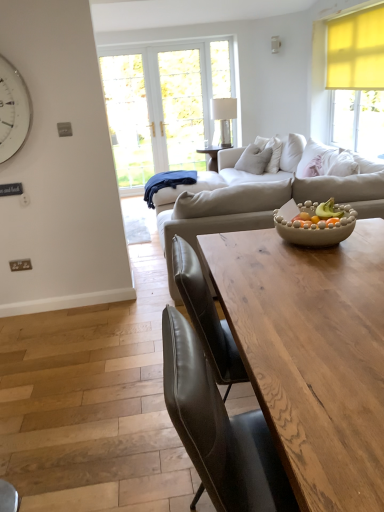
Question: Does wooden table at center have a lesser width compared to beige textured bowl at center?

Choices:
 (A) yes
 (B) no

Answer: (B)

Question: From a real-world perspective, is wooden table at center positioned under beige textured bowl at center based on gravity?

Choices:
 (A) yes
 (B) no

Answer: (A)

Question: Can you confirm if wooden table at center is positioned to the right of beige textured bowl at center?

Choices:
 (A) yes
 (B) no

Answer: (B)

Question: Can you confirm if wooden table at center is smaller than beige textured bowl at center?

Choices:
 (A) no
 (B) yes

Answer: (A)

Question: Does wooden table at center have a greater width compared to beige textured bowl at center?

Choices:
 (A) no
 (B) yes

Answer: (B)

Question: Considering the relative sizes of wooden table at center and beige textured bowl at center in the image provided, is wooden table at center taller than beige textured bowl at center?

Choices:
 (A) no
 (B) yes

Answer: (B)

Question: Is wooden table at center outside white metallic clock at upper left?

Choices:
 (A) no
 (B) yes

Answer: (B)

Question: Can you confirm if wooden table at center is shorter than white metallic clock at upper left?

Choices:
 (A) no
 (B) yes

Answer: (A)

Question: Is wooden table at center bigger than white metallic clock at upper left?

Choices:
 (A) yes
 (B) no

Answer: (A)

Question: From a real-world perspective, is wooden table at center beneath white metallic clock at upper left?

Choices:
 (A) yes
 (B) no

Answer: (A)

Question: Considering the relative sizes of wooden table at center and white metallic clock at upper left in the image provided, is wooden table at center wider than white metallic clock at upper left?

Choices:
 (A) yes
 (B) no

Answer: (A)

Question: Is wooden table at center thinner than white metallic clock at upper left?

Choices:
 (A) yes
 (B) no

Answer: (B)

Question: Is light beige fabric pillow at center smaller than beige textured bowl at center?

Choices:
 (A) no
 (B) yes

Answer: (A)